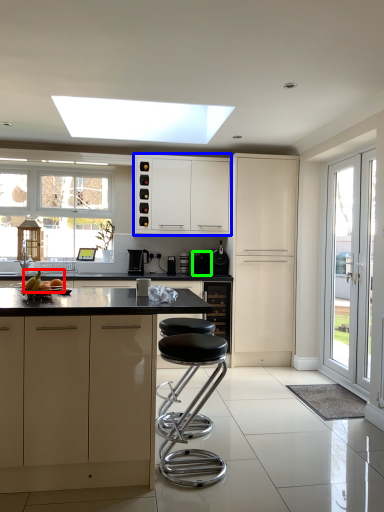
Question: Considering the real-world distances, which object is farthest from fruit (highlighted by a red box)? cabinetry (highlighted by a blue box) or appliance (highlighted by a green box)?

Choices:
 (A) cabinetry
 (B) appliance

Answer: (B)